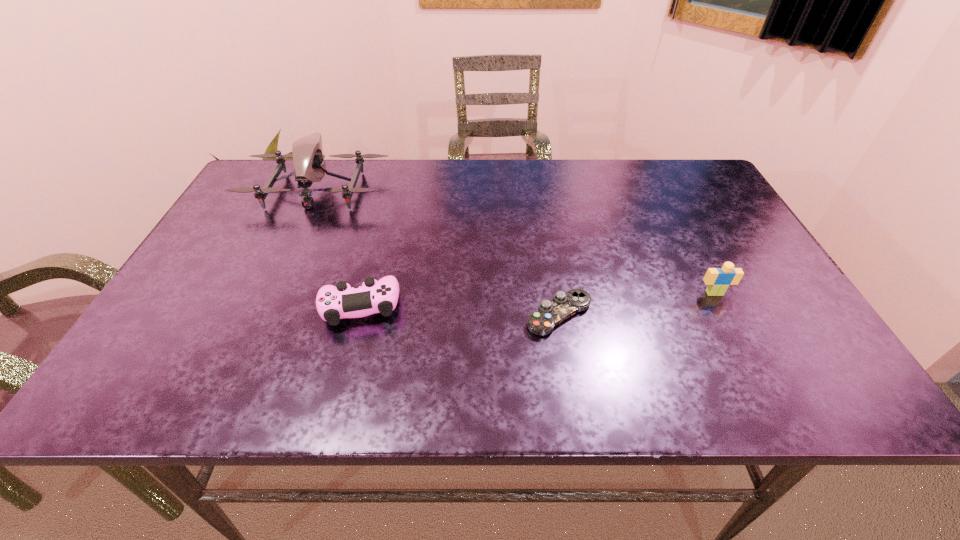
The height and width of the screenshot is (540, 960). Identify the location of drone. (307, 155).

Where is `the tallest object`? The width and height of the screenshot is (960, 540). the tallest object is located at coordinates point(307,155).

Find the location of a particular element. This screenshot has width=960, height=540. the rightmost object is located at coordinates click(x=718, y=280).

Locate an element on the screen. Image resolution: width=960 pixels, height=540 pixels. Lego is located at coordinates (718, 280).

Locate an element on the screen. the second shortest object is located at coordinates (333, 303).

In order to click on the taller control in this screenshot , I will do `click(333, 303)`.

This screenshot has width=960, height=540. Find the location of `the second object from right to left`. the second object from right to left is located at coordinates (551, 313).

The image size is (960, 540). In order to click on the shortest object in this screenshot , I will do `click(551, 313)`.

Identify the location of free space located on the front-facing side of the farthest object. The height and width of the screenshot is (540, 960). (297, 233).

The height and width of the screenshot is (540, 960). In order to click on blank space located 0.230m on the face of the Lego in this screenshot , I will do `click(763, 389)`.